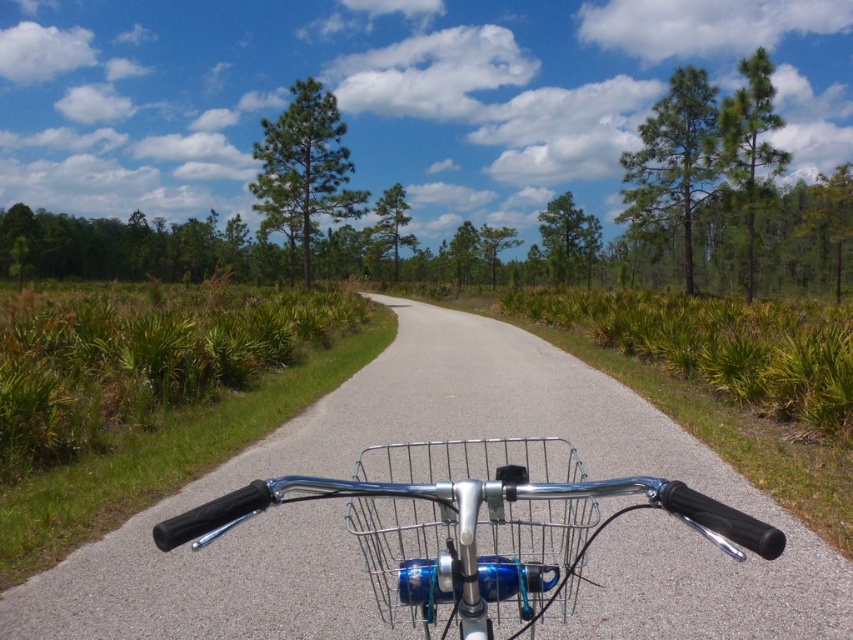
You are a cyclist looking ahead on the path. There are two points marked on the path ahead of you. The first point is at coordinates point (469,595) and the second point is at point (508,563). Which point is closer to your current position?

Point (469,595) is closer to the camera than point (508,563), so the first point is closer to your current position.

You are riding a bike and looking down at the road and handlebars. Which object is positioned to the right side from your viewpoint? The metallic asphalt road at center or the polished chrome bicycle handlebars at center?

The metallic asphalt road at center is to the right of the polished chrome bicycle handlebars at center from your viewpoint.